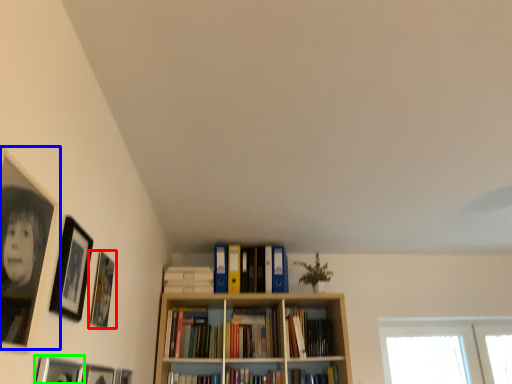
Question: Which object is positioned farthest from picture frame (highlighted by a red box)? Select from picture frame (highlighted by a blue box) and picture frame (highlighted by a green box).

Choices:
 (A) picture frame
 (B) picture frame

Answer: (A)